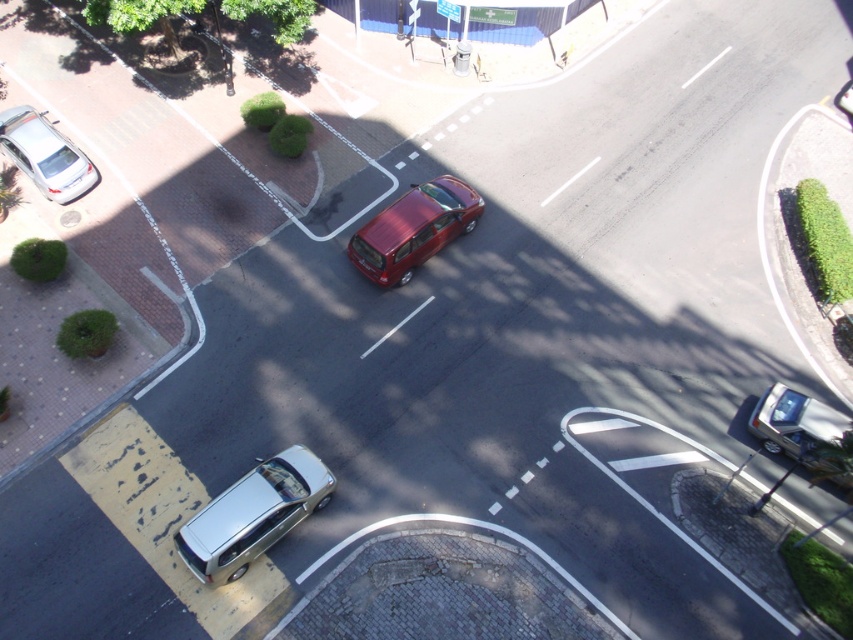
You are a pedestrian standing at the point labeled point (444,237) and want to cross the street to reach point (762,410). Which direction should you walk to get closer to your destination?

You should walk away from the viewer because point (444,237) is closer to you than point (762,410), so moving away from your current position will bring you closer to the destination.

You are a delivery driver needing to park your 5.5 meter long truck between the silver metallic van at lower left and the silver metallic sedan at left. Can you fit your truck in the space between them?

The space between the silver metallic van at lower left and the silver metallic sedan at left is 11.35 meters. Since your truck is 5.5 meters long, there is enough space to park it between them.